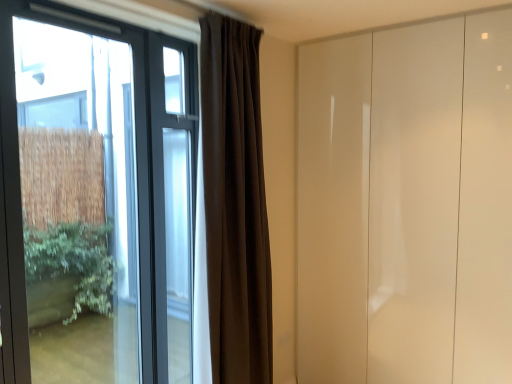
Question: Is glossy white door at right closer to the viewer compared to clear glass window at left?

Choices:
 (A) yes
 (B) no

Answer: (B)

Question: Is glossy white door at right not near clear glass window at left?

Choices:
 (A) yes
 (B) no

Answer: (A)

Question: Considering the relative sizes of glossy white door at right and clear glass window at left in the image provided, is glossy white door at right shorter than clear glass window at left?

Choices:
 (A) yes
 (B) no

Answer: (B)

Question: Is glossy white door at right positioned with its back to clear glass window at left?

Choices:
 (A) yes
 (B) no

Answer: (B)

Question: Considering the relative sizes of glossy white door at right and clear glass window at left in the image provided, is glossy white door at right wider than clear glass window at left?

Choices:
 (A) no
 (B) yes

Answer: (B)

Question: Would you say dark matte curtain at center is to the left or to the right of clear glass window at left in the picture?

Choices:
 (A) left
 (B) right

Answer: (B)

Question: Relative to clear glass window at left, is dark matte curtain at center in front or behind?

Choices:
 (A) front
 (B) behind

Answer: (B)

Question: Is dark matte curtain at center taller or shorter than clear glass window at left?

Choices:
 (A) short
 (B) tall

Answer: (B)

Question: Is dark matte curtain at center wider or thinner than clear glass window at left?

Choices:
 (A) wide
 (B) thin

Answer: (A)

Question: Is dark matte curtain at center wider or thinner than glossy white door at right?

Choices:
 (A) wide
 (B) thin

Answer: (B)

Question: From the image's perspective, relative to glossy white door at right, is dark matte curtain at center above or below?

Choices:
 (A) below
 (B) above

Answer: (B)

Question: Considering the positions of point (232, 112) and point (463, 72), is point (232, 112) closer or farther from the camera than point (463, 72)?

Choices:
 (A) closer
 (B) farther

Answer: (A)

Question: Considering their positions, is dark matte curtain at center located in front of or behind glossy white door at right?

Choices:
 (A) behind
 (B) front

Answer: (B)

Question: Looking at the image, does clear glass window at left seem bigger or smaller compared to glossy white door at right?

Choices:
 (A) big
 (B) small

Answer: (B)

Question: Does point (60, 218) appear closer or farther from the camera than point (470, 183)?

Choices:
 (A) farther
 (B) closer

Answer: (A)